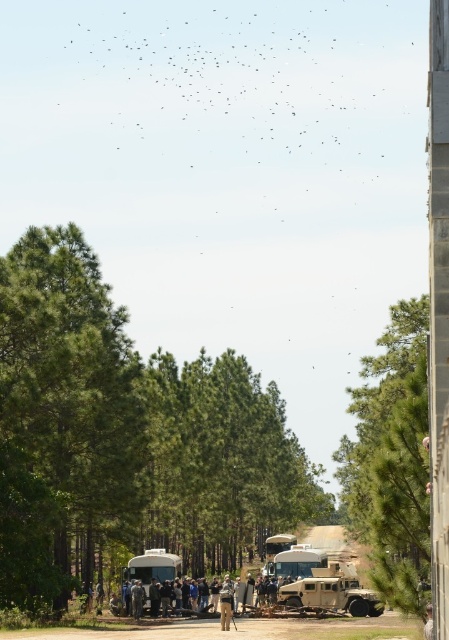
Can you confirm if camouflage fabric military vehicle at center is smaller than camouflage fabric person at center?

Incorrect, camouflage fabric military vehicle at center is not smaller in size than camouflage fabric person at center.

Who is shorter, camouflage fabric military vehicle at center or camouflage fabric person at center?

With less height is camouflage fabric military vehicle at center.

This screenshot has height=640, width=449. I want to click on camouflage fabric military vehicle at center, so click(330, 592).

Where is `camouflage fabric military vehicle at center`? This screenshot has width=449, height=640. camouflage fabric military vehicle at center is located at coordinates (330, 592).

Measure the distance between green leafy tree at center and camera.

52.46 meters

Who is more forward, (193,529) or (150,554)?

Point (150,554)

Image resolution: width=449 pixels, height=640 pixels. Find the location of `green leafy tree at center`. green leafy tree at center is located at coordinates (124, 435).

Between point (145, 568) and point (229, 600), which one is positioned behind?

Positioned behind is point (145, 568).

How far apart are matte white rv at center and camouflage fabric person at center?

matte white rv at center is 13.16 meters from camouflage fabric person at center.

Find the location of a particular element. matte white rv at center is located at coordinates (153, 568).